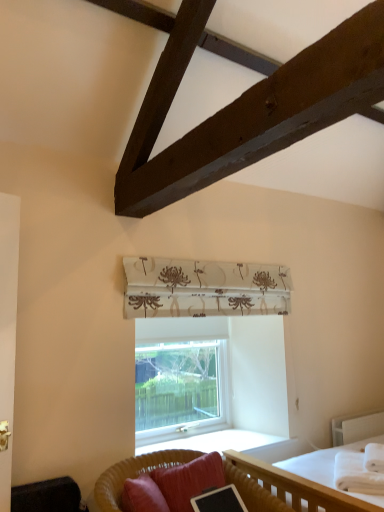
The height and width of the screenshot is (512, 384). I want to click on woven rattan studio couch at lower center, so click(133, 474).

What is the approximate width of woven rattan studio couch at lower center?

It is 84.52 centimeters.

Describe the element at coordinates (356, 426) in the screenshot. I see `white textured balustrade at lower right` at that location.

Locate an element on the screen. Image resolution: width=384 pixels, height=512 pixels. velvet red pillow at lower center is located at coordinates (189, 480).

This screenshot has height=512, width=384. What do you see at coordinates (189, 480) in the screenshot? I see `velvet red pillow at lower center` at bounding box center [189, 480].

Looking at this image, in order to face white wooden bed at lower right, should I rotate leftwards or rightwards?

It's best to rotate right around 25.447 degrees.

Where is `velvet black swivel chair at lower left`? The image size is (384, 512). velvet black swivel chair at lower left is located at coordinates (48, 496).

Which object is thinner, white soft blanket at lower right or woven rattan studio couch at lower center?

white soft blanket at lower right is thinner.

Is white soft blanket at lower right positioned beyond the bounds of woven rattan studio couch at lower center?

Yes, white soft blanket at lower right is located beyond the bounds of woven rattan studio couch at lower center.

Can you confirm if white soft blanket at lower right is smaller than woven rattan studio couch at lower center?

Yes, white soft blanket at lower right is smaller than woven rattan studio couch at lower center.

Based on their positions, is white soft blanket at lower right located to the left or right of woven rattan studio couch at lower center?

Clearly, white soft blanket at lower right is on the right of woven rattan studio couch at lower center in the image.

Is the surface of velvet red pillow at lower center in direct contact with white textured balustrade at lower right?

No, velvet red pillow at lower center is not in contact with white textured balustrade at lower right.

This screenshot has width=384, height=512. I want to click on pillow above the white textured balustrade at lower right (from the image's perspective), so 189,480.

Who is bigger, velvet red pillow at lower center or white textured balustrade at lower right?

With larger size is velvet red pillow at lower center.

Considering the sizes of objects velvet red pillow at lower center and white textured balustrade at lower right in the image provided, who is wider, velvet red pillow at lower center or white textured balustrade at lower right?

With larger width is velvet red pillow at lower center.

The height and width of the screenshot is (512, 384). Find the location of `pillow on the right of the velvet black swivel chair at lower left`. pillow on the right of the velvet black swivel chair at lower left is located at coordinates (189, 480).

Between velvet black swivel chair at lower left and velvet red pillow at lower center, which one has larger size?

With larger size is velvet red pillow at lower center.

From the image's perspective, is velvet black swivel chair at lower left above or below velvet red pillow at lower center?

From the image's perspective, velvet black swivel chair at lower left appears below velvet red pillow at lower center.

Who is smaller, velvet black swivel chair at lower left or woven rattan studio couch at lower center?

With smaller size is velvet black swivel chair at lower left.

Where is `studio couch on the right of velvet black swivel chair at lower left`? studio couch on the right of velvet black swivel chair at lower left is located at coordinates (133, 474).

Considering the relative sizes of velvet red pillow at lower center and white soft blanket at lower right in the image provided, is velvet red pillow at lower center taller than white soft blanket at lower right?

Indeed, velvet red pillow at lower center has a greater height compared to white soft blanket at lower right.

Looking at this image, is white soft blanket at lower right inside velvet red pillow at lower center?

Actually, white soft blanket at lower right is outside velvet red pillow at lower center.

Between velvet red pillow at lower center and white soft blanket at lower right, which one appears on the left side from the viewer's perspective?

From the viewer's perspective, velvet red pillow at lower center appears more on the left side.

How different are the orientations of velvet red pillow at lower center and white soft blanket at lower right in degrees?

The angular difference between velvet red pillow at lower center and white soft blanket at lower right is 32.4 degrees.

From a real-world perspective, which object rests below the other?

From a 3D spatial view, white wooden bed at lower right is below.

What's the angular difference between white textured balustrade at lower right and white wooden bed at lower right's facing directions?

They differ by 1.35 degrees in their facing directions.

Looking at this image, is white textured balustrade at lower right far from white wooden bed at lower right?

Yes, white textured balustrade at lower right is far from white wooden bed at lower right.

From the image's perspective, which is above, white textured balustrade at lower right or white wooden bed at lower right?

white wooden bed at lower right appears higher in the image.

Is white textured balustrade at lower right oriented away from velvet black swivel chair at lower left?

No, white textured balustrade at lower right's orientation is not away from velvet black swivel chair at lower left.

From a real-world perspective, who is located lower, white textured balustrade at lower right or velvet black swivel chair at lower left?

In real-world perspective, white textured balustrade at lower right is lower.

From the image's perspective, between white textured balustrade at lower right and velvet black swivel chair at lower left, which one is located above?

velvet black swivel chair at lower left.

Identify the location of blanket positioned vertically above the woven rattan studio couch at lower center (from a real-world perspective). The image size is (384, 512). (361, 470).

Identify the location of pillow on the left of the white textured balustrade at lower right. This screenshot has width=384, height=512. (189, 480).

Estimate the real-world distances between objects in this image. Which object is further from velvet black swivel chair at lower left, velvet red pillow at lower center or white wooden bed at lower right?

white wooden bed at lower right is further to velvet black swivel chair at lower left.

Estimate the real-world distances between objects in this image. Which object is further from velvet black swivel chair at lower left, white textured balustrade at lower right or woven rattan studio couch at lower center?

The object further to velvet black swivel chair at lower left is white textured balustrade at lower right.

Estimate the real-world distances between objects in this image. Which object is closer to white textured balustrade at lower right, velvet black swivel chair at lower left or velvet red pillow at lower center?

velvet red pillow at lower center is closer to white textured balustrade at lower right.

Looking at the image, which one is located closer to white wooden bed at lower right, white soft blanket at lower right or velvet red pillow at lower center?

Among the two, white soft blanket at lower right is located nearer to white wooden bed at lower right.

Considering their positions, is white soft blanket at lower right positioned closer to woven rattan studio couch at lower center than velvet black swivel chair at lower left?

velvet black swivel chair at lower left lies closer to woven rattan studio couch at lower center than the other object.

When comparing their distances from white soft blanket at lower right, does white textured balustrade at lower right or velvet red pillow at lower center seem closer?

Based on the image, velvet red pillow at lower center appears to be nearer to white soft blanket at lower right.

From the image, which object appears to be farther from white wooden bed at lower right, velvet black swivel chair at lower left or white textured balustrade at lower right?

white textured balustrade at lower right is further to white wooden bed at lower right.

Which object lies further to the anchor point white textured balustrade at lower right, white wooden bed at lower right or clear glass window at center?

clear glass window at center is further to white textured balustrade at lower right.

Identify the location of studio couch between velvet black swivel chair at lower left and white wooden bed at lower right. The width and height of the screenshot is (384, 512). (133, 474).

Find the location of a particular element. The width and height of the screenshot is (384, 512). window between velvet black swivel chair at lower left and white soft blanket at lower right is located at coordinates (180, 389).

Where is `window between woven rattan studio couch at lower center and white textured balustrade at lower right in the front-back direction`? This screenshot has height=512, width=384. window between woven rattan studio couch at lower center and white textured balustrade at lower right in the front-back direction is located at coordinates (180, 389).

Where is `pillow positioned between white wooden bed at lower right and white textured balustrade at lower right from near to far`? pillow positioned between white wooden bed at lower right and white textured balustrade at lower right from near to far is located at coordinates (189, 480).